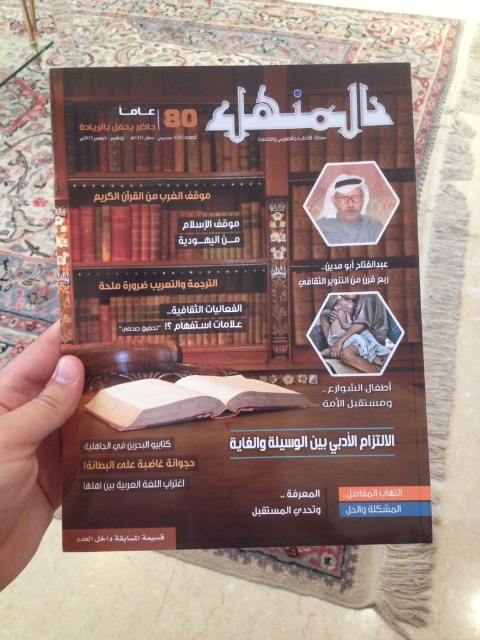
Question: Observing the image, what is the correct spatial positioning of matte black book at upper left in reference to matte paper book at center?

Choices:
 (A) below
 (B) above

Answer: (B)

Question: Which point appears farthest from the camera in this image?

Choices:
 (A) (370, 323)
 (B) (220, 140)
 (C) (14, 528)

Answer: (B)

Question: Is skin tonewoodenhand at left behind matte black book at upper left?

Choices:
 (A) yes
 (B) no

Answer: (B)

Question: Which of the following is the farthest from the observer?

Choices:
 (A) smooth beige skin at center
 (B) hardcover book at center

Answer: (B)

Question: Which object is closer to the camera taking this photo?

Choices:
 (A) skin tonewoodenhand at left
 (B) hardcover book at center

Answer: (A)

Question: Does smooth beige skin at center come in front of light brown skin at center?

Choices:
 (A) no
 (B) yes

Answer: (B)